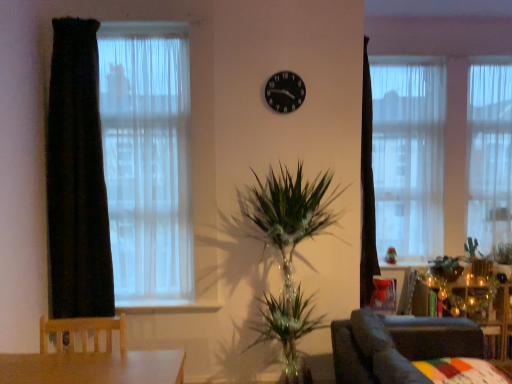
Question: Does green leafy plant at right contain white sheer curtain at upper right, the second curtain in the back-to-front sequence?

Choices:
 (A) yes
 (B) no

Answer: (B)

Question: Could you tell me if green leafy plant at right is facing white sheer curtain at upper right, the second curtain when ordered from front to back?

Choices:
 (A) no
 (B) yes

Answer: (A)

Question: Is white sheer curtain at upper right, the second curtain when ordered from front to back, at the back of green leafy plant at right?

Choices:
 (A) no
 (B) yes

Answer: (A)

Question: Does green leafy plant at right have a smaller size compared to white sheer curtain at upper right, the second curtain when ordered from front to back?

Choices:
 (A) no
 (B) yes

Answer: (B)

Question: Is green leafy plant at right further to the viewer compared to white sheer curtain at upper right, the second curtain from the right?

Choices:
 (A) no
 (B) yes

Answer: (A)

Question: From a real-world perspective, is wooden side table at lower right above or below dark velvet curtain at left, the 3th curtain when ordered from right to left?

Choices:
 (A) below
 (B) above

Answer: (A)

Question: Is point (498, 284) closer or farther from the camera than point (58, 31)?

Choices:
 (A) farther
 (B) closer

Answer: (A)

Question: Considering the relative positions of wooden side table at lower right and dark velvet curtain at left, the 1th curtain when ordered from left to right, in the image provided, is wooden side table at lower right to the left or to the right of dark velvet curtain at left, the 1th curtain when ordered from left to right,?

Choices:
 (A) left
 (B) right

Answer: (B)

Question: From the image's perspective, is wooden side table at lower right positioned above or below dark velvet curtain at left, which ranks as the 3th curtain in back-to-front order?

Choices:
 (A) above
 (B) below

Answer: (B)

Question: Considering the positions of white sheer curtain at left and white sheer curtain at right, the 1th curtain when ordered from back to front, in the image, is white sheer curtain at left wider or thinner than white sheer curtain at right, the 1th curtain when ordered from back to front,?

Choices:
 (A) thin
 (B) wide

Answer: (A)

Question: Which is correct: white sheer curtain at left is inside white sheer curtain at right, acting as the 3th curtain starting from the front, or outside of it?

Choices:
 (A) outside
 (B) inside

Answer: (A)

Question: Looking at the image, does white sheer curtain at left seem bigger or smaller compared to white sheer curtain at right, acting as the 3th curtain starting from the front?

Choices:
 (A) big
 (B) small

Answer: (A)

Question: Does point 182,188 appear closer or farther from the camera than point 496,71?

Choices:
 (A) closer
 (B) farther

Answer: (A)

Question: Is point (438, 89) positioned closer to the camera than point (480, 81)?

Choices:
 (A) closer
 (B) farther

Answer: (B)

Question: Is white sheer curtain at upper right, the second curtain in the back-to-front sequence, wider or thinner than white sheer curtain at right, the 1th curtain when ordered from back to front?

Choices:
 (A) wide
 (B) thin

Answer: (B)